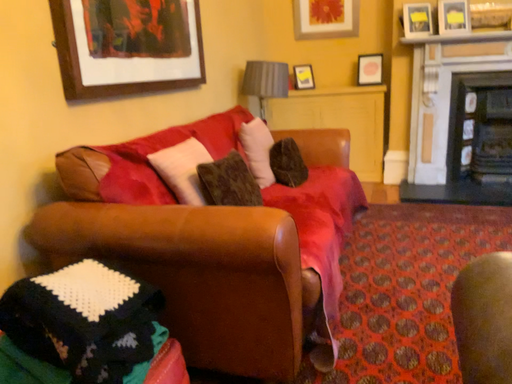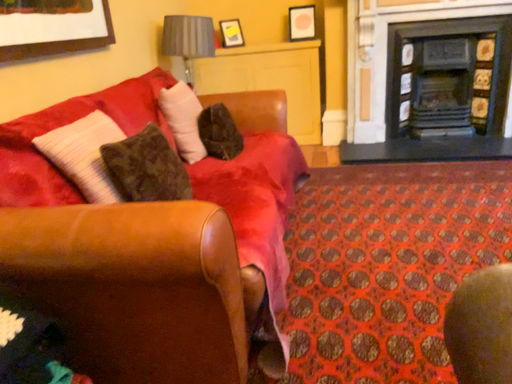
Question: How did the camera likely rotate when shooting the video?

Choices:
 (A) rotated right
 (B) rotated left

Answer: (A)